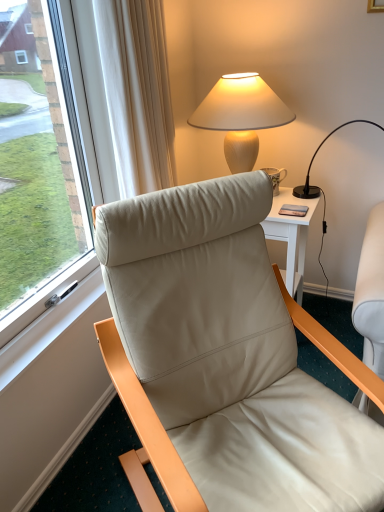
Question: Does point (317, 188) appear closer or farther from the camera than point (294, 214)?

Choices:
 (A) farther
 (B) closer

Answer: (A)

Question: Is black glass lamp at upper right, arranged as the 2th lamp when viewed from the left, bigger or smaller than matte black phone at upper right?

Choices:
 (A) big
 (B) small

Answer: (A)

Question: Estimate the real-world distances between objects in this image. Which object is closer to the matte black phone at upper right?

Choices:
 (A) matte beige lampshade at upper right, the second lamp viewed from the right
 (B) black glass lamp at upper right, which is the first lamp in right-to-left order
 (C) leather at left
 (D) porcelain floral mug at right

Answer: (D)

Question: Which object is positioned closest to the matte black phone at upper right?

Choices:
 (A) matte beige lampshade at upper right, the 1th lamp viewed from the left
 (B) leather at left
 (C) black glass lamp at upper right, which is the first lamp in right-to-left order
 (D) porcelain floral mug at right

Answer: (D)